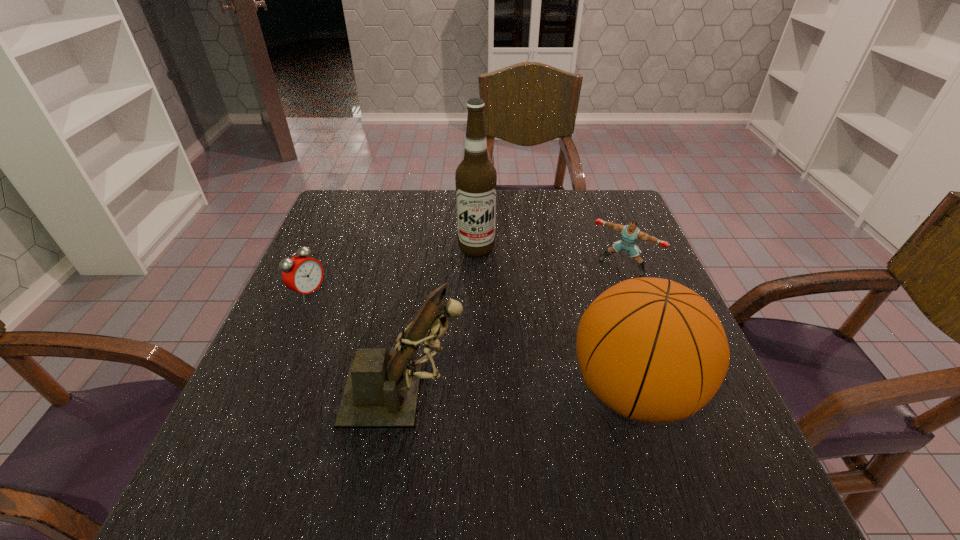
I want to click on free space located on the front-facing side of the alarm clock, so click(395, 335).

Locate an element on the screen. This screenshot has height=540, width=960. vacant space located 0.120m on the label of the tallest object is located at coordinates 479,292.

Find the location of a particular element. The height and width of the screenshot is (540, 960). vacant region located 0.300m on the label of the tallest object is located at coordinates (483, 350).

You are a GUI agent. You are given a task and a screenshot of the screen. Output one action in this format:
    pyautogui.click(x=<x>, y=<y>)
    Task: Click on the free space located 0.100m on the label of the tallest object
    
    Given the screenshot: What is the action you would take?
    pyautogui.click(x=479, y=286)

The height and width of the screenshot is (540, 960). In order to click on free spot located 0.330m on the front-facing side of the puncher in this screenshot , I will do `click(543, 368)`.

I want to click on vacant space located on the front-facing side of the puncher, so click(x=558, y=348).

What are the coordinates of `vacant space located on the front-facing side of the puncher` in the screenshot? It's located at (593, 300).

At what (x,y) coordinates should I click in order to perform the action: click on figurine located in the near edge section of the desktop. Please return your answer as a coordinate pair (x, y). Looking at the image, I should click on (381, 391).

Where is `basketball present at the near edge`? Image resolution: width=960 pixels, height=540 pixels. basketball present at the near edge is located at coordinates (653, 350).

At what (x,y) coordinates should I click in order to perform the action: click on object present at the left edge. Please return your answer as a coordinate pair (x, y). Looking at the image, I should click on (302, 274).